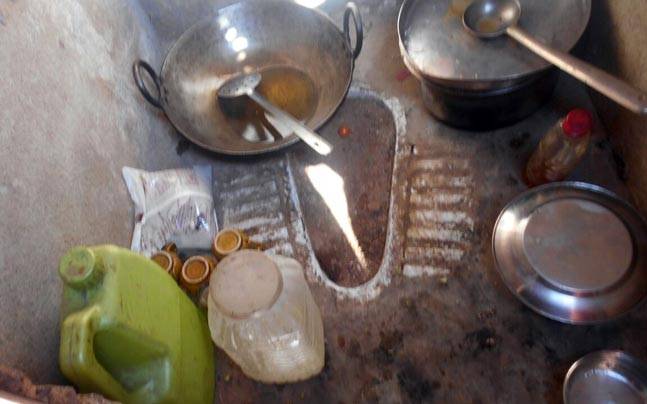
Where is `wok's handles`? This screenshot has width=647, height=404. wok's handles is located at coordinates (149, 97), (358, 36).